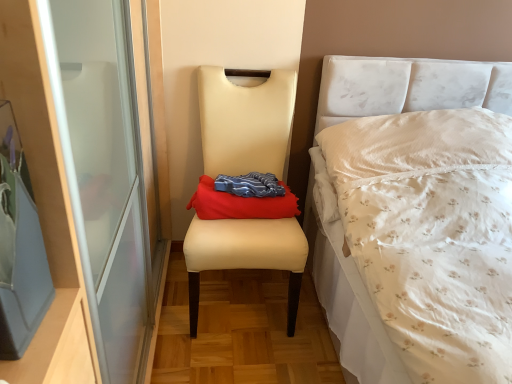
Question: Can you see beige leather chair at center touching red fabric throw pillow at center?

Choices:
 (A) no
 (B) yes

Answer: (A)

Question: Does beige leather chair at center appear on the right side of red fabric throw pillow at center?

Choices:
 (A) yes
 (B) no

Answer: (B)

Question: Is the position of beige leather chair at center more distant than that of red fabric throw pillow at center?

Choices:
 (A) yes
 (B) no

Answer: (B)

Question: Is beige leather chair at center positioned beyond the bounds of red fabric throw pillow at center?

Choices:
 (A) yes
 (B) no

Answer: (A)

Question: From a real-world perspective, is beige leather chair at center positioned under red fabric throw pillow at center based on gravity?

Choices:
 (A) yes
 (B) no

Answer: (A)

Question: Is the depth of beige leather chair at center less than that of red fabric throw pillow at center?

Choices:
 (A) yes
 (B) no

Answer: (A)

Question: Is the depth of red fabric throw pillow at center less than that of beige leather chair at center?

Choices:
 (A) yes
 (B) no

Answer: (B)

Question: Considering the relative positions of red fabric throw pillow at center and beige leather chair at center in the image provided, is red fabric throw pillow at center to the right of beige leather chair at center from the viewer's perspective?

Choices:
 (A) no
 (B) yes

Answer: (B)

Question: Would you consider red fabric throw pillow at center to be distant from beige leather chair at center?

Choices:
 (A) no
 (B) yes

Answer: (A)

Question: Is red fabric throw pillow at center positioned behind beige leather chair at center?

Choices:
 (A) no
 (B) yes

Answer: (B)

Question: Can you confirm if red fabric throw pillow at center is smaller than beige leather chair at center?

Choices:
 (A) yes
 (B) no

Answer: (A)

Question: Does red fabric throw pillow at center turn towards beige leather chair at center?

Choices:
 (A) no
 (B) yes

Answer: (B)

Question: In terms of height, does beige leather chair at center look taller or shorter compared to red fabric throw pillow at center?

Choices:
 (A) tall
 (B) short

Answer: (A)